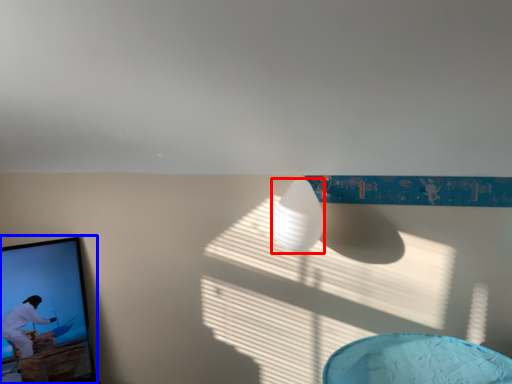
Question: Among these objects, which one is farthest to the camera, lamp (highlighted by a red box) or picture frame (highlighted by a blue box)?

Choices:
 (A) lamp
 (B) picture frame

Answer: (B)